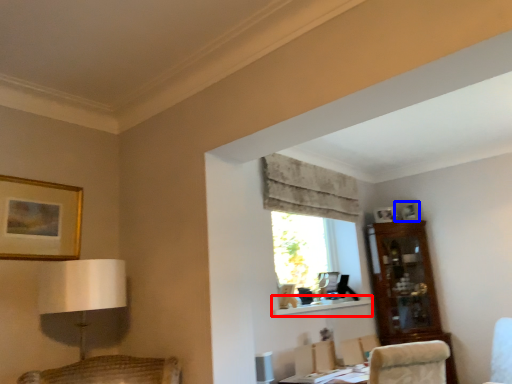
Question: Which object appears farthest to the camera in this image, shelf (highlighted by a red box) or picture frame (highlighted by a blue box)?

Choices:
 (A) shelf
 (B) picture frame

Answer: (B)